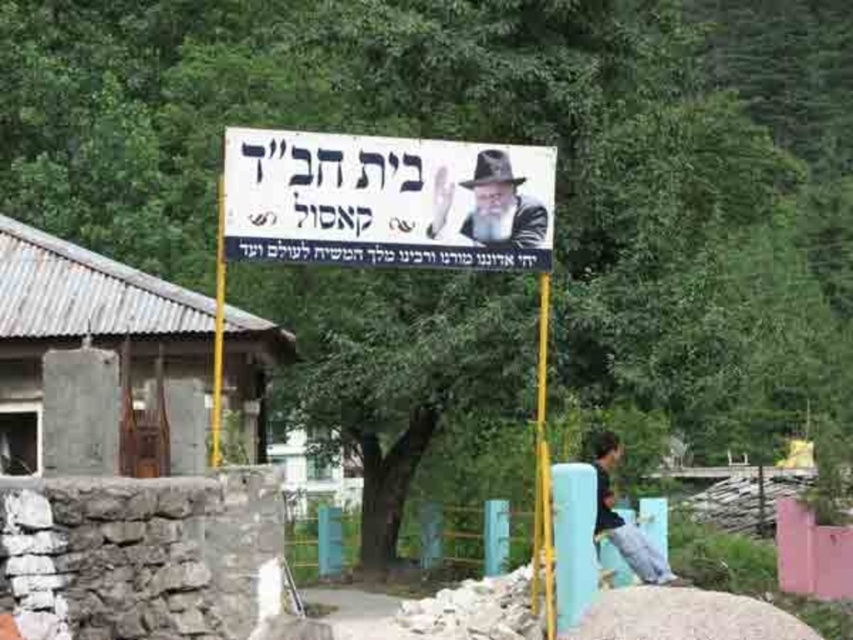
Question: Based on their relative distances, which object is farther from the white matte portrait at center?

Choices:
 (A) light blue jeans at lower right
 (B) rusty metal hut at left
 (C) white paper sign at center
 (D) yellow metallic pole at center

Answer: (B)

Question: Does yellow metallic pole at center appear under yellow plastic pole at center?

Choices:
 (A) no
 (B) yes

Answer: (B)

Question: Estimate the real-world distances between objects in this image. Which object is farther from the yellow plastic pole at center?

Choices:
 (A) light blue jeans at lower right
 (B) white matte portrait at center

Answer: (A)

Question: Can you confirm if white matte portrait at center is positioned above yellow plastic pole at center?

Choices:
 (A) yes
 (B) no

Answer: (A)

Question: Estimate the real-world distances between objects in this image. Which object is farther from the rusty metal hut at left?

Choices:
 (A) white matte portrait at center
 (B) white paper sign at center

Answer: (A)

Question: Can you confirm if yellow metallic pole at center is bigger than yellow plastic pole at center?

Choices:
 (A) yes
 (B) no

Answer: (B)